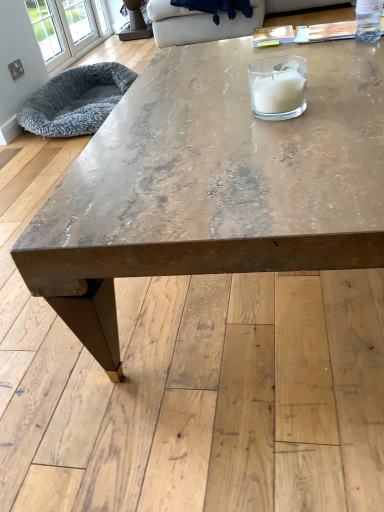
Question: From a real-world perspective, is beige fabric couch at upper center physically above white glass candle at upper center?

Choices:
 (A) yes
 (B) no

Answer: (B)

Question: Is beige fabric couch at upper center next to white glass candle at upper center?

Choices:
 (A) no
 (B) yes

Answer: (A)

Question: Can you confirm if beige fabric couch at upper center is smaller than white glass candle at upper center?

Choices:
 (A) no
 (B) yes

Answer: (A)

Question: Does beige fabric couch at upper center come behind white glass candle at upper center?

Choices:
 (A) no
 (B) yes

Answer: (B)

Question: Considering the relative positions of beige fabric couch at upper center and white glass candle at upper center in the image provided, is beige fabric couch at upper center to the right of white glass candle at upper center from the viewer's perspective?

Choices:
 (A) no
 (B) yes

Answer: (A)

Question: From the image's perspective, relative to clear glass bottle at upper right, is beige fabric couch at upper center above or below?

Choices:
 (A) below
 (B) above

Answer: (B)

Question: Would you say beige fabric couch at upper center is to the left or to the right of clear glass bottle at upper right in the picture?

Choices:
 (A) right
 (B) left

Answer: (B)

Question: From a real-world perspective, relative to clear glass bottle at upper right, is beige fabric couch at upper center vertically above or below?

Choices:
 (A) above
 (B) below

Answer: (B)

Question: In terms of size, does beige fabric couch at upper center appear bigger or smaller than clear glass bottle at upper right?

Choices:
 (A) small
 (B) big

Answer: (B)

Question: Visually, is white glass window at upper left positioned to the left or to the right of clear glass bottle at upper right?

Choices:
 (A) right
 (B) left

Answer: (B)

Question: From the image's perspective, is white glass window at upper left located above or below clear glass bottle at upper right?

Choices:
 (A) above
 (B) below

Answer: (A)

Question: Considering the positions of white glass window at upper left and clear glass bottle at upper right in the image, is white glass window at upper left wider or thinner than clear glass bottle at upper right?

Choices:
 (A) wide
 (B) thin

Answer: (B)

Question: In terms of height, does white glass window at upper left look taller or shorter compared to clear glass bottle at upper right?

Choices:
 (A) short
 (B) tall

Answer: (B)

Question: In terms of height, does white glass candle at upper center look taller or shorter compared to distressed wood coffee table at center?

Choices:
 (A) tall
 (B) short

Answer: (B)

Question: Does point (274, 105) appear closer or farther from the camera than point (263, 234)?

Choices:
 (A) closer
 (B) farther

Answer: (B)